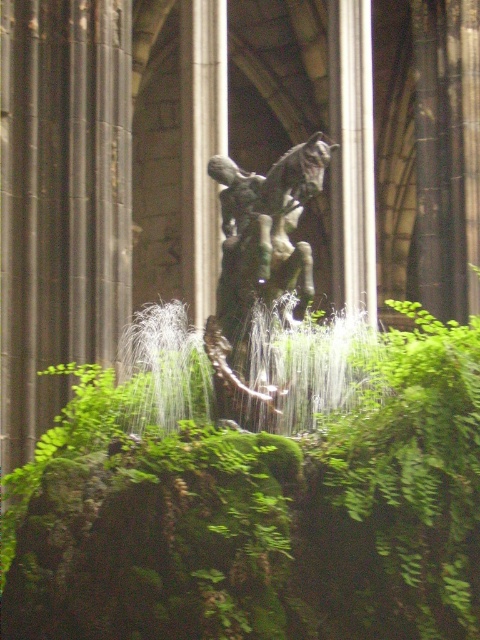
Question: Does green mossy rock at center have a smaller size compared to green patina metal horse at center?

Choices:
 (A) no
 (B) yes

Answer: (A)

Question: Which object is closer to the camera taking this photo?

Choices:
 (A) green mossy rock at center
 (B) green patina metal horse at center

Answer: (A)

Question: Where is green mossy rock at center located in relation to green patina metal horse at center in the image?

Choices:
 (A) right
 (B) left

Answer: (A)

Question: Which of the following is the farthest from the observer?

Choices:
 (A) green patina metal horse at center
 (B) green mossy rock at center

Answer: (A)

Question: Is green mossy rock at center bigger than green patina metal horse at center?

Choices:
 (A) yes
 (B) no

Answer: (A)